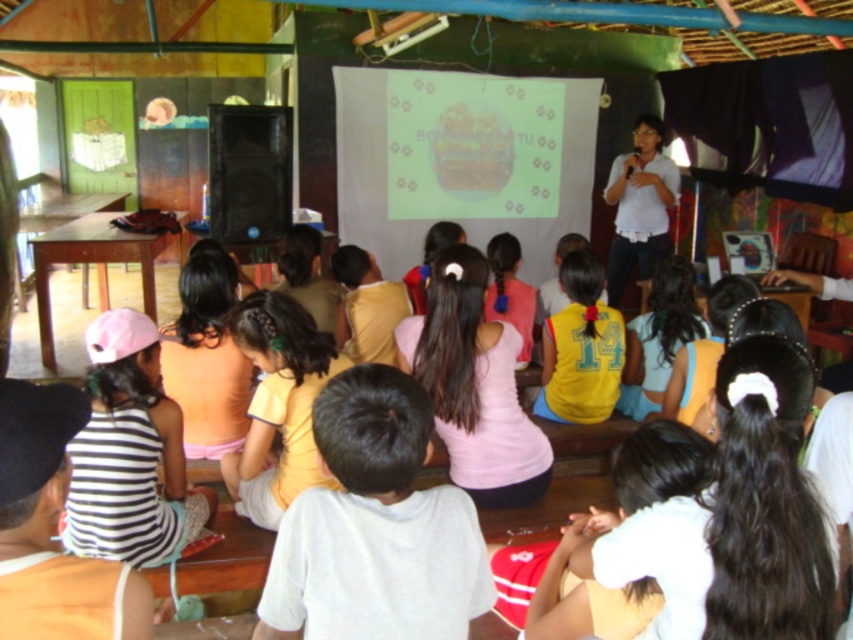
You are standing in the classroom and notice two points on the projector screen. The first point is at coordinates point (440, 612) and the second is at point (619, 257). Which point is closer to you?

Point (440, 612) is closer to the camera than point (619, 257), so the first point is closer to you.

In the classroom scene, where is the yellow matte shirt at center located in terms of coordinates?

The yellow matte shirt at center is located at point coordinates of (277,404).

You are a photographer standing at the back of the classroom. You want to take a photo that includes both the white cotton shirt at center and the white matte shirt at upper right. Given that your camera has a maximum focus range of 5 meters, will you be able to capture both shirts in focus?

The distance between the white cotton shirt at center and the white matte shirt at upper right is 4.75 meters, which is within the camera maximum focus range of 5 meters. Therefore, you can capture both shirts in focus.